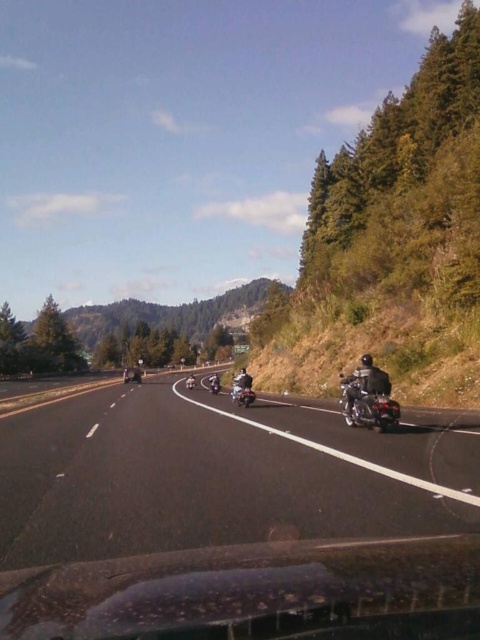
You are driving a car and want to pass the shiny chrome motorcycle at center on the black asphalt road at center. Can you safely pass the motorcycle without changing lanes?

The black asphalt road at center might be wider than shiny chrome motorcycle at center, so it is possible that there is enough space to safely pass the motorcycle without changing lanes. However, the exact width is uncertain based on the given information.

You are driving a car and want to know if you can safely pass the shiny silver motorcycle at center on the black asphalt road at center. Based on the road and motorcycle lengths, can you determine if there is enough space to pass safely?

The black asphalt road at center is shorter than the shiny silver motorcycle at center, so there is not enough space to safely pass the motorcycle.

You are driving a car and looking at the road ahead. There are two points marked on the road in front of you at coordinates point (41, 442) and point (235, 396). Which point is closer to your car?

Point (41, 442) is closer to the camera than point (235, 396).